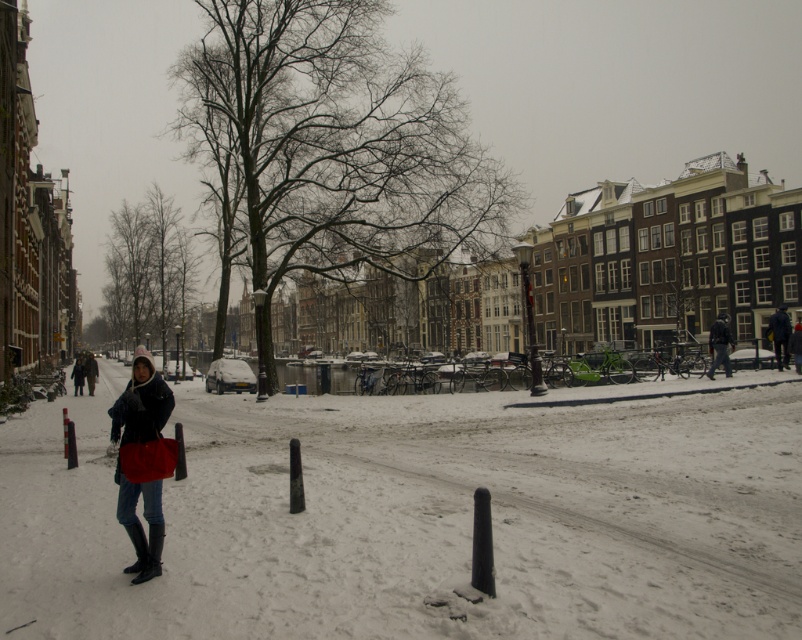
Is white matte snow at center thinner than dark blue jacket at center?

No, white matte snow at center is not thinner than dark blue jacket at center.

Does white matte snow at center have a smaller size compared to dark blue jacket at center?

No.

Does point (543, 544) lie behind point (88, 392)?

No.

The width and height of the screenshot is (802, 640). I want to click on white matte snow at center, so click(416, 518).

How distant is white matte snow at center from dark blue jeans at right?

white matte snow at center is 54.83 feet from dark blue jeans at right.

Measure the distance between white matte snow at center and camera.

A distance of 15.59 feet exists between white matte snow at center and camera.

Image resolution: width=802 pixels, height=640 pixels. I want to click on white matte snow at center, so coord(416,518).

Is dark blue jeans at right further to the viewer compared to dark blue jacket at center?

That is False.

Which is above, dark blue jeans at right or dark blue jacket at center?

dark blue jeans at right is higher up.

Describe the element at coordinates (780, 333) in the screenshot. I see `dark blue jeans at right` at that location.

Where is `dark blue jeans at right`? The height and width of the screenshot is (640, 802). dark blue jeans at right is located at coordinates tap(780, 333).